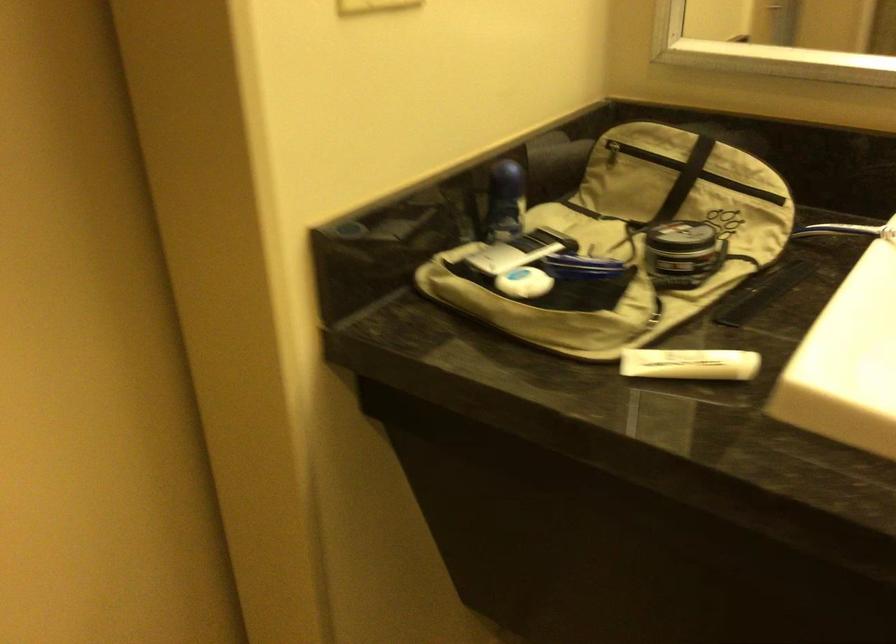
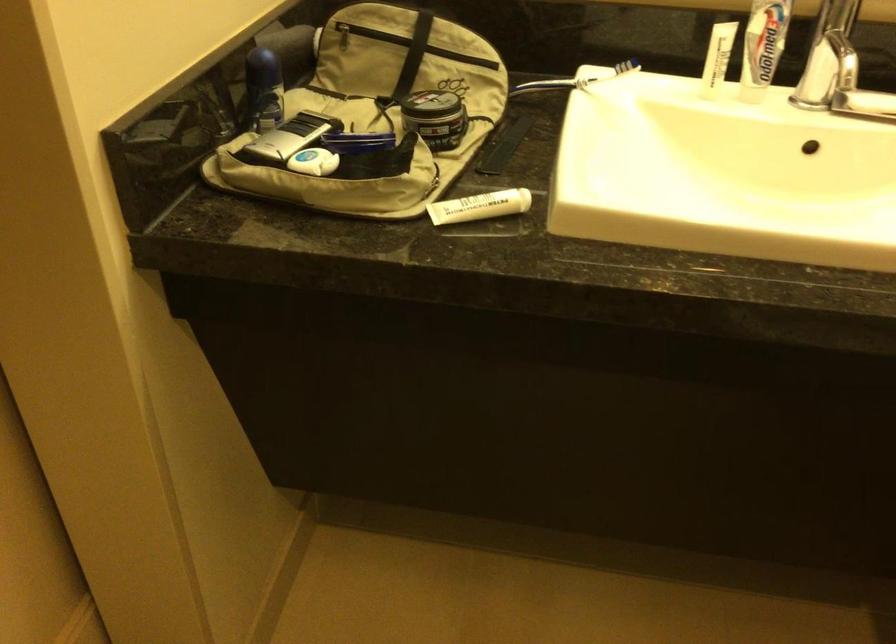
Find the pixel in the second image that matches point 687,365 in the first image.

(479, 205)